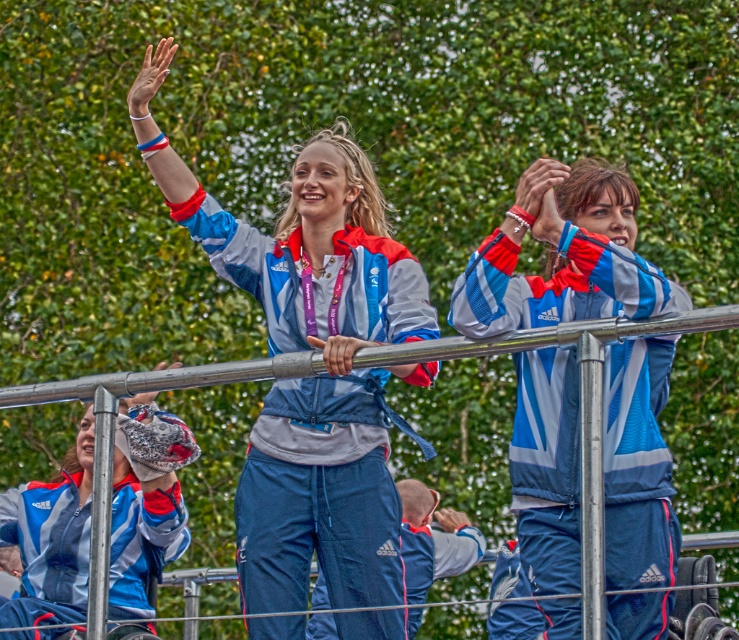
Question: Is matte blue tracksuit at center bigger than blue reflective jacket at center?

Choices:
 (A) yes
 (B) no

Answer: (A)

Question: Can you confirm if matte blue tracksuit at center is wider than blue reflective jacket at center?

Choices:
 (A) no
 (B) yes

Answer: (B)

Question: Observing the image, what is the correct spatial positioning of matte blue tracksuit at center in reference to blue reflective jacket at center?

Choices:
 (A) above
 (B) below

Answer: (A)

Question: Among these objects, which one is nearest to the camera?

Choices:
 (A) matte blue tracksuit at center
 (B) blue reflective jacket at center

Answer: (B)

Question: Which point is closer to the camera?

Choices:
 (A) (x=372, y=234)
 (B) (x=545, y=524)

Answer: (B)